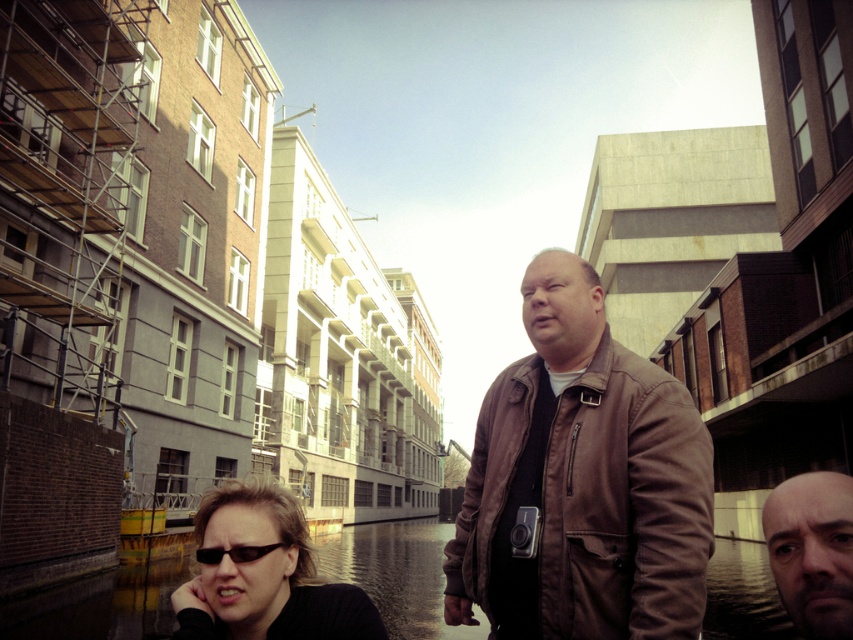
You are a photographer trying to frame a shot of the brown leather jacket at center and the black plastic sunglasses at lower left. Which object should you adjust your camera angle to include first if the jacket is wider?

The brown leather jacket at center is wider than the black plastic sunglasses at lower left, so you should adjust your camera angle to include the brown leather jacket at center first.

You are a photographer trying to capture a candid shot of the bald head at center and the black plastic sunglasses at lower left. Which subject should you focus on first to ensure both are in frame?

The bald head at center is closer to the viewer than the black plastic sunglasses at lower left, so focus on the bald head at center first to ensure both are in frame.